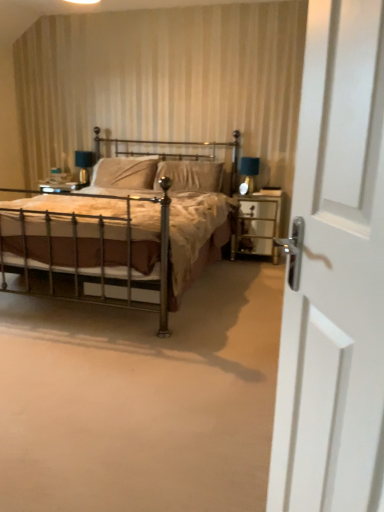
Question: Should I look upward or downward to see matte blue glass table lamp at upper left, marked as the 1th table lamp in a back-to-front arrangement?

Choices:
 (A) up
 (B) down

Answer: (A)

Question: Can you confirm if matte black table lamp at right, placed as the 2th table lamp when sorted from back to front, is thinner than white glossy door at right?

Choices:
 (A) no
 (B) yes

Answer: (A)

Question: Are matte black table lamp at right, arranged as the second table lamp when viewed from the left, and white glossy door at right far apart?

Choices:
 (A) no
 (B) yes

Answer: (B)

Question: Does matte black table lamp at right, arranged as the second table lamp when viewed from the left, appear on the left side of white glossy door at right?

Choices:
 (A) no
 (B) yes

Answer: (A)

Question: Is matte black table lamp at right, the 1th table lamp when ordered from right to left, smaller than white glossy door at right?

Choices:
 (A) no
 (B) yes

Answer: (B)

Question: Is matte black table lamp at right, placed as the 2th table lamp when sorted from back to front, oriented towards white glossy door at right?

Choices:
 (A) yes
 (B) no

Answer: (A)

Question: Is matte black table lamp at right, placed as the 2th table lamp when sorted from back to front, not within white glossy door at right?

Choices:
 (A) yes
 (B) no

Answer: (A)

Question: Is polished brass bed at center at the back of suede-like beige pillow at center, the 2th pillow positioned from the left?

Choices:
 (A) no
 (B) yes

Answer: (B)

Question: Can polished brass bed at center be found inside suede-like beige pillow at center, the 2th pillow positioned from the left?

Choices:
 (A) no
 (B) yes

Answer: (A)

Question: Is suede-like beige pillow at center, the 1th pillow in the right-to-left sequence, completely or partially outside of polished brass bed at center?

Choices:
 (A) no
 (B) yes

Answer: (A)

Question: Is suede-like beige pillow at center, the 1th pillow in the right-to-left sequence, oriented towards polished brass bed at center?

Choices:
 (A) yes
 (B) no

Answer: (A)

Question: Is the depth of suede-like beige pillow at center, the 1th pillow in the right-to-left sequence, less than that of polished brass bed at center?

Choices:
 (A) no
 (B) yes

Answer: (A)

Question: Considering the relative positions of suede-like beige pillow at center, the 2th pillow positioned from the left, and polished brass bed at center in the image provided, is suede-like beige pillow at center, the 2th pillow positioned from the left, to the right of polished brass bed at center from the viewer's perspective?

Choices:
 (A) yes
 (B) no

Answer: (A)

Question: Is polished brass bed at center oriented away from matte black table lamp at right, placed as the 2th table lamp when sorted from back to front?

Choices:
 (A) yes
 (B) no

Answer: (B)